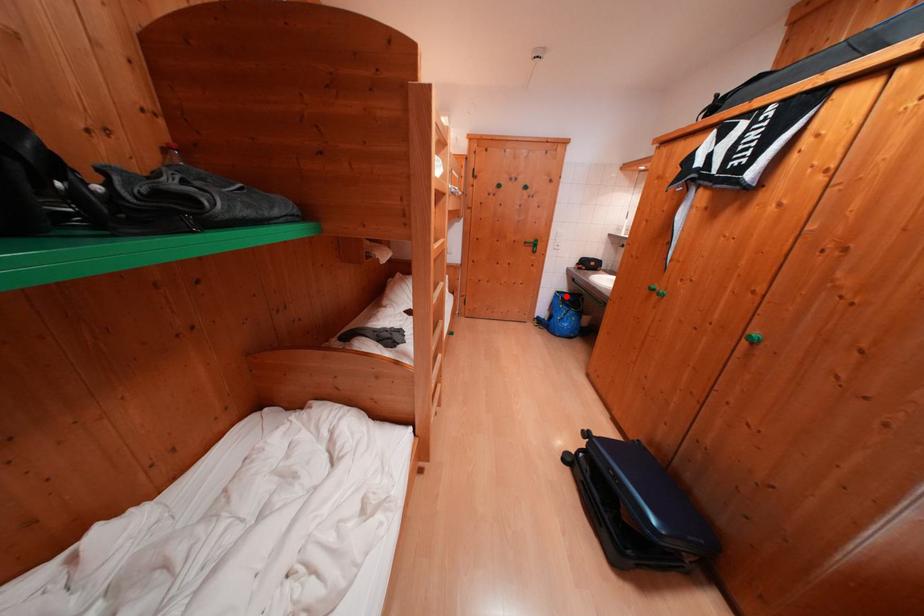
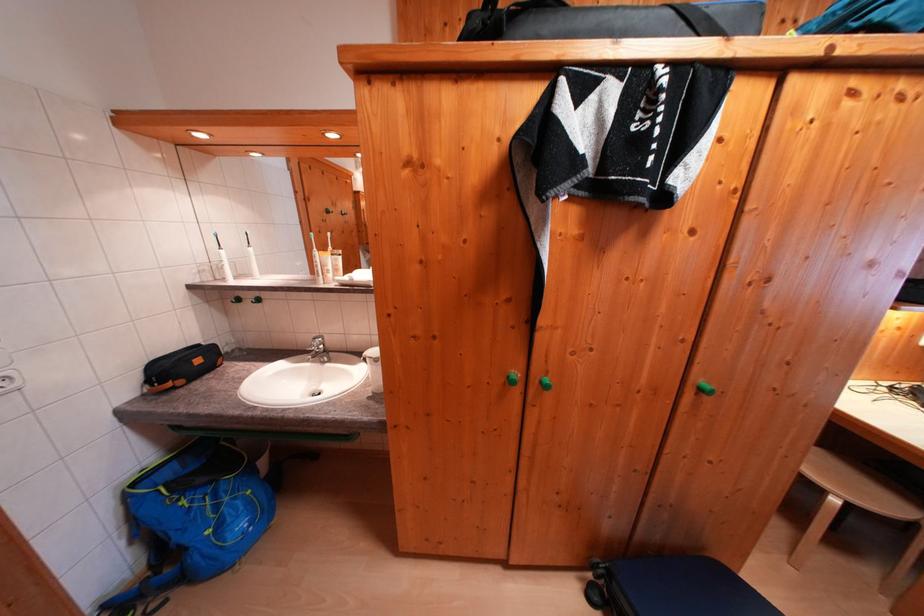
Question: I am providing you with two images of the same scene from different viewpoints. Given a red point in image1, look at the same physical point in image2. Is it:

Choices:
 (A) Closer to the viewpoint
 (B) Farther from the viewpoint

Answer: (B)